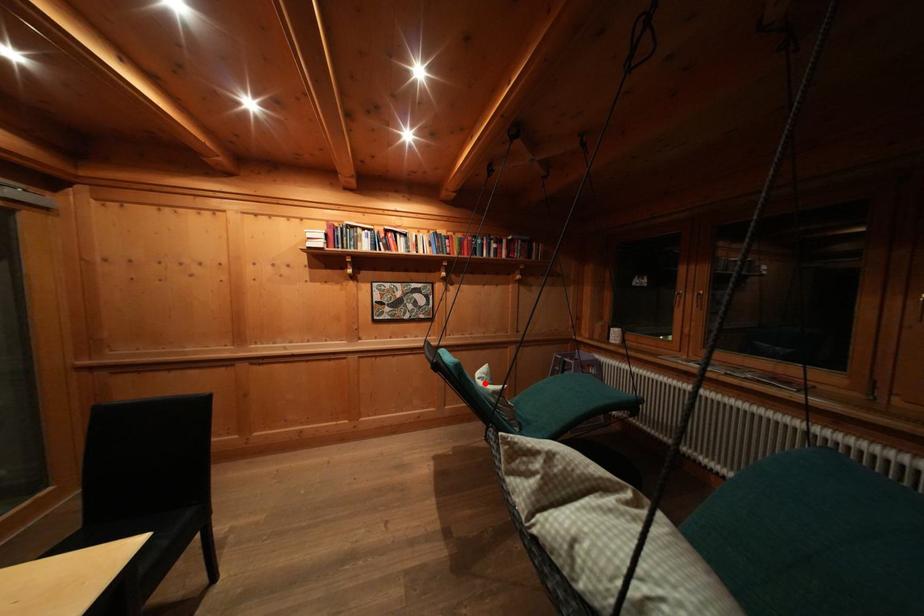
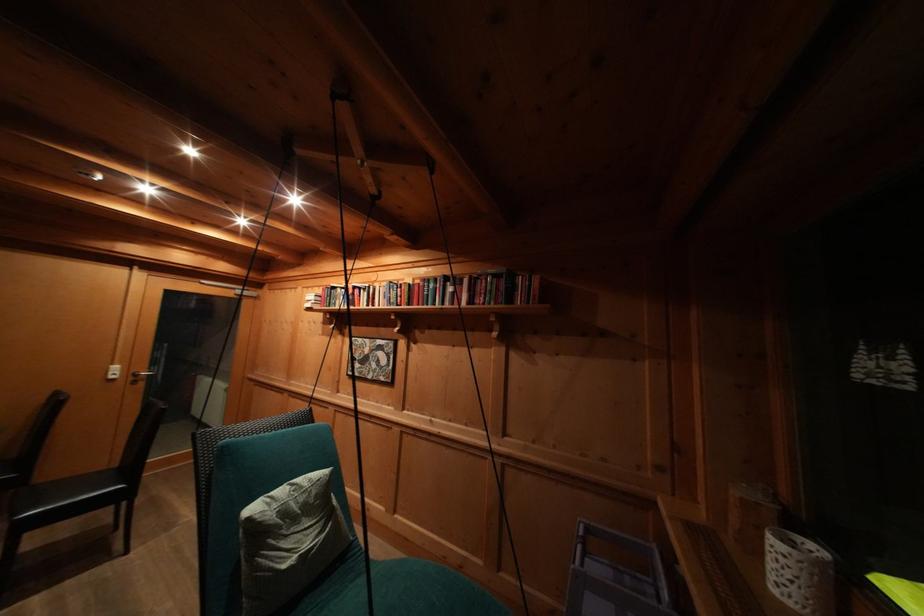
The point at the highlighted location is marked in the first image. Where is the corresponding point in the second image?

(298, 490)